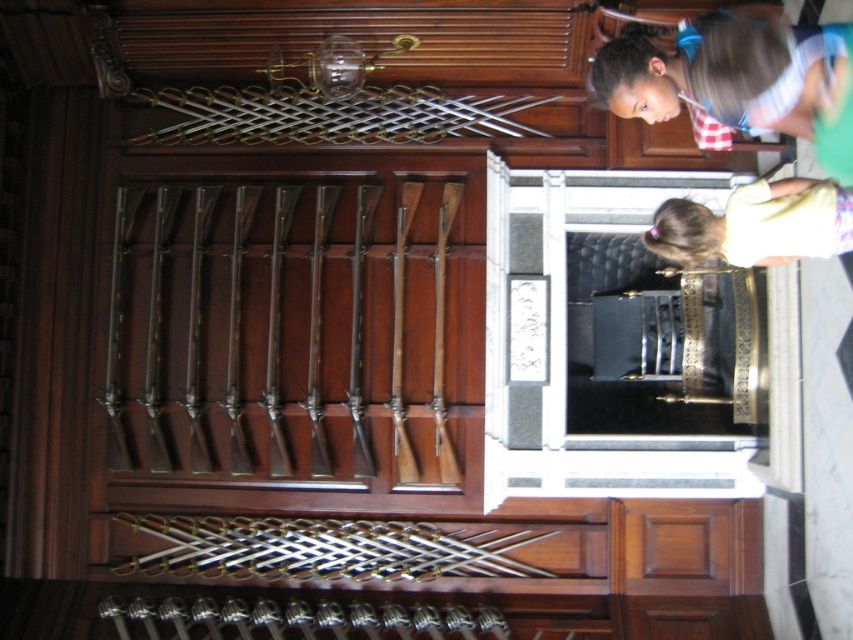
You are standing in front of a historical display cabinet with a polished brass rifle at center. You want to take a closer look at the rifle without touching it. Considering the distance between you and the rifle, can you comfortably reach it with a 10 feet long measuring tape?

The distance between the polished brass rifle at center and the viewer is 20.30 feet. Since the measuring tape is only 10 feet long, it is not long enough to reach the rifle from your current position.

You are a security guard in the museum and notice a light yellow shirt at lower right and a polished silver rifle at center. Which object is taller?

The polished silver rifle at center is taller than the light yellow shirt at lower right.